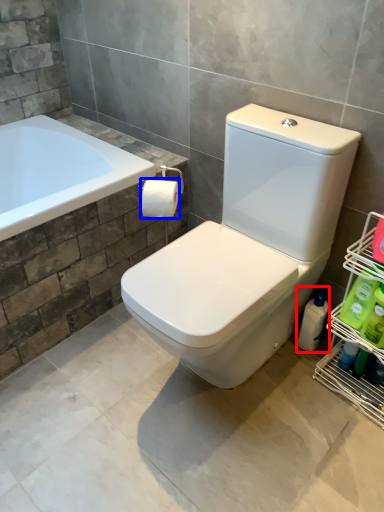
Question: Which point is further to the camera, cleaning product (highlighted by a red box) or toilet paper (highlighted by a blue box)?

Choices:
 (A) cleaning product
 (B) toilet paper

Answer: (A)